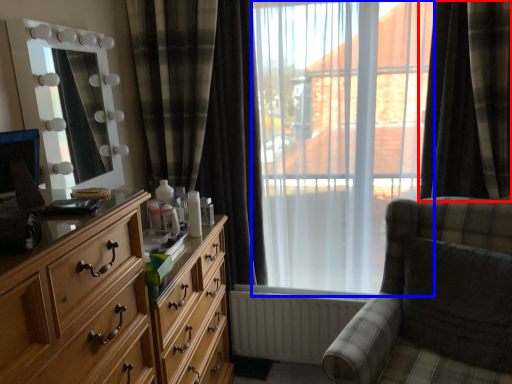
Question: Among these objects, which one is farthest to the camera, curtain (highlighted by a red box) or bay window (highlighted by a blue box)?

Choices:
 (A) curtain
 (B) bay window

Answer: (B)